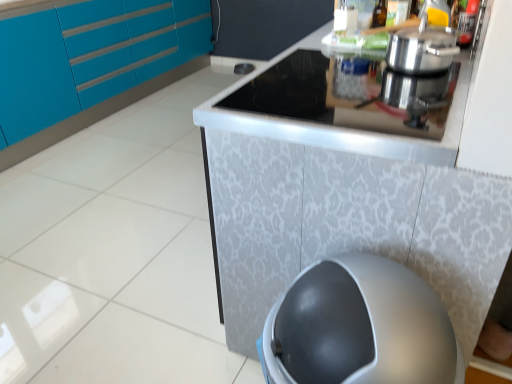
Question: Considering the positions of translucent glass bottle at upper center and black glass cooktop at upper center in the image, is translucent glass bottle at upper center bigger or smaller than black glass cooktop at upper center?

Choices:
 (A) small
 (B) big

Answer: (A)

Question: Based on their positions, is translucent glass bottle at upper center located to the left or right of black glass cooktop at upper center?

Choices:
 (A) left
 (B) right

Answer: (B)

Question: Considering the real-world distances, which object is closest to the translucent glass bottle at upper center?

Choices:
 (A) teal glossy cabinets at upper left
 (B) black glass cooktop at upper center
 (C) silver textured counter at center

Answer: (B)

Question: Estimate the real-world distances between objects in this image. Which object is closer to the silver textured counter at center?

Choices:
 (A) translucent glass bottle at upper center
 (B) black glass cooktop at upper center
 (C) teal glossy cabinets at upper left

Answer: (B)